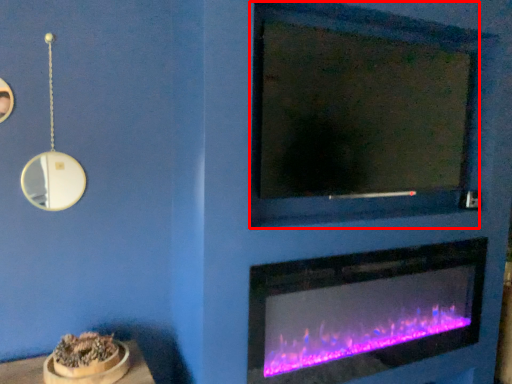
Question: From the image, what is the correct spatial relationship of mirror (annotated by the red box) in relation to fireplace?

Choices:
 (A) right
 (B) left

Answer: (B)